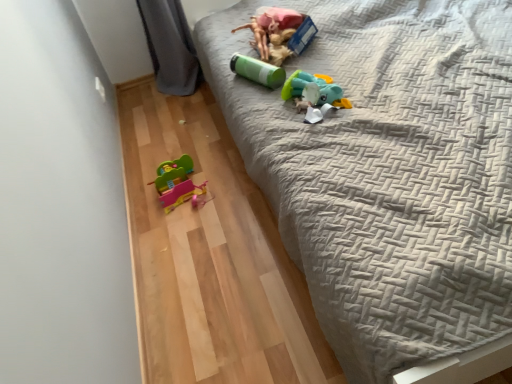
Locate an element on the screen. Image resolution: width=512 pixels, height=384 pixels. green matte canister at upper center, the second toy in the top-to-bottom sequence is located at coordinates (257, 71).

Where is `gray quilted bed at upper right`? This screenshot has width=512, height=384. gray quilted bed at upper right is located at coordinates (388, 172).

Identify the location of teal matte plush toy at upper center, which is counted as the second toy, starting from the bottom. (314, 94).

You are a GUI agent. You are given a task and a screenshot of the screen. Output one action in this format:
    pyautogui.click(x=<x>, y=<y>)
    Task: Click on the matte green plastic cup at upper center, which is the first toy in top-to-bottom order
    
    Given the screenshot: What is the action you would take?
    pyautogui.click(x=273, y=32)

The width and height of the screenshot is (512, 384). Describe the element at coordinates (176, 183) in the screenshot. I see `matte plastic toy car at lower left, which is counted as the 4th toy, starting from the top` at that location.

Identify the location of green matte canister at upper center, the second toy in the top-to-bottom sequence. Image resolution: width=512 pixels, height=384 pixels. (257, 71).

Is matte green plastic cup at upper center, which is the first toy in top-to-bottom order, positioned with its back to teal matte plush toy at upper center, which is counted as the second toy, starting from the bottom?

No, matte green plastic cup at upper center, which is the first toy in top-to-bottom order,'s orientation is not away from teal matte plush toy at upper center, which is counted as the second toy, starting from the bottom.

From the image's perspective, is matte green plastic cup at upper center, the 4th toy from the bottom, on teal matte plush toy at upper center, acting as the third toy starting from the top?

Yes, from the image's perspective, matte green plastic cup at upper center, the 4th toy from the bottom, is over teal matte plush toy at upper center, acting as the third toy starting from the top.

Is matte green plastic cup at upper center, the 4th toy from the bottom, directly adjacent to teal matte plush toy at upper center, acting as the third toy starting from the top?

No, matte green plastic cup at upper center, the 4th toy from the bottom, is not touching teal matte plush toy at upper center, acting as the third toy starting from the top.

Is point (280, 48) behind point (310, 105)?

Yes, point (280, 48) is farther from viewer.

Considering the positions of objects teal matte plush toy at upper center, acting as the third toy starting from the top, and gray quilted bed at upper right in the image provided, who is more to the left, teal matte plush toy at upper center, acting as the third toy starting from the top, or gray quilted bed at upper right?

teal matte plush toy at upper center, acting as the third toy starting from the top.

Which is behind, point (341, 104) or point (450, 72)?

Positioned behind is point (450, 72).

From the image's perspective, which object appears higher, teal matte plush toy at upper center, acting as the third toy starting from the top, or gray quilted bed at upper right?

gray quilted bed at upper right, from the image's perspective.

Does teal matte plush toy at upper center, acting as the third toy starting from the top, lie in front of gray quilted bed at upper right?

No.

From the image's perspective, is gray quilted bed at upper right positioned above or below green matte canister at upper center, which is the third toy from bottom to top?

Based on their image positions, gray quilted bed at upper right is located above green matte canister at upper center, which is the third toy from bottom to top.

Is point (368, 334) farther from camera compared to point (249, 72)?

That is False.

In the scene shown: What's the angular difference between gray quilted bed at upper right and green matte canister at upper center, which is the third toy from bottom to top,'s facing directions?

The angular difference between gray quilted bed at upper right and green matte canister at upper center, which is the third toy from bottom to top, is 26.3 degrees.

Who is taller, gray quilted bed at upper right or green matte canister at upper center, which is the third toy from bottom to top?

Standing taller between the two is gray quilted bed at upper right.

From a real-world perspective, which is physically below, green matte canister at upper center, which is the third toy from bottom to top, or matte green plastic cup at upper center, the 4th toy from the bottom?

From a 3D spatial view, green matte canister at upper center, which is the third toy from bottom to top, is below.

Is green matte canister at upper center, which is the third toy from bottom to top, with matte green plastic cup at upper center, which is the first toy in top-to-bottom order?

No, green matte canister at upper center, which is the third toy from bottom to top, is not in contact with matte green plastic cup at upper center, which is the first toy in top-to-bottom order.

Does green matte canister at upper center, the second toy in the top-to-bottom sequence, appear on the right side of matte green plastic cup at upper center, the 4th toy from the bottom?

No.

The image size is (512, 384). In order to click on toy above the green matte canister at upper center, the second toy in the top-to-bottom sequence (from the image's perspective) in this screenshot , I will do `click(273, 32)`.

In terms of size, does matte plastic toy car at lower left, marked as the 1th toy in a bottom-to-top arrangement, appear bigger or smaller than gray quilted bed at upper right?

Clearly, matte plastic toy car at lower left, marked as the 1th toy in a bottom-to-top arrangement, is smaller in size than gray quilted bed at upper right.

What's the angular difference between matte plastic toy car at lower left, which is counted as the 4th toy, starting from the top, and gray quilted bed at upper right's facing directions?

The angle between the facing direction of matte plastic toy car at lower left, which is counted as the 4th toy, starting from the top, and the facing direction of gray quilted bed at upper right is 89.8 degrees.

From a real-world perspective, is matte plastic toy car at lower left, which is counted as the 4th toy, starting from the top, over gray quilted bed at upper right?

Actually, matte plastic toy car at lower left, which is counted as the 4th toy, starting from the top, is physically below gray quilted bed at upper right in the real world.

Can you see green matte canister at upper center, the second toy in the top-to-bottom sequence, touching teal matte plush toy at upper center, which is counted as the second toy, starting from the bottom?

There is a gap between green matte canister at upper center, the second toy in the top-to-bottom sequence, and teal matte plush toy at upper center, which is counted as the second toy, starting from the bottom.

Is point (248, 78) in front of point (304, 94)?

No, it is behind (304, 94).

Could you tell me if green matte canister at upper center, which is the third toy from bottom to top, is turned towards teal matte plush toy at upper center, which is counted as the second toy, starting from the bottom?

Yes, green matte canister at upper center, which is the third toy from bottom to top, is facing teal matte plush toy at upper center, which is counted as the second toy, starting from the bottom.

Between green matte canister at upper center, the second toy in the top-to-bottom sequence, and teal matte plush toy at upper center, which is counted as the second toy, starting from the bottom, which one has larger size?

With larger size is teal matte plush toy at upper center, which is counted as the second toy, starting from the bottom.

Which object is closer to the camera, gray quilted bed at upper right or matte plastic toy car at lower left, which is counted as the 4th toy, starting from the top?

Positioned in front is gray quilted bed at upper right.

Which is more to the left, gray quilted bed at upper right or matte plastic toy car at lower left, which is counted as the 4th toy, starting from the top?

matte plastic toy car at lower left, which is counted as the 4th toy, starting from the top, is more to the left.

From a real-world perspective, is gray quilted bed at upper right beneath matte plastic toy car at lower left, which is counted as the 4th toy, starting from the top?

Incorrect, from a real-world perspective, gray quilted bed at upper right is higher than matte plastic toy car at lower left, which is counted as the 4th toy, starting from the top.

Is matte plastic toy car at lower left, marked as the 1th toy in a bottom-to-top arrangement, at the back of gray quilted bed at upper right?

No, gray quilted bed at upper right's orientation is not away from matte plastic toy car at lower left, marked as the 1th toy in a bottom-to-top arrangement.

Where is `toy that is the 2nd one when counting upward from the teal matte plush toy at upper center, acting as the third toy starting from the top (from the image's perspective)`? The image size is (512, 384). toy that is the 2nd one when counting upward from the teal matte plush toy at upper center, acting as the third toy starting from the top (from the image's perspective) is located at coordinates (273, 32).

You are a GUI agent. You are given a task and a screenshot of the screen. Output one action in this format:
    pyautogui.click(x=<x>, y=<y>)
    Task: Click on the bed on the right of teal matte plush toy at upper center, which is counted as the second toy, starting from the bottom
    This screenshot has width=512, height=384.
    Given the screenshot: What is the action you would take?
    pyautogui.click(x=388, y=172)

Estimate the real-world distances between objects in this image. Which object is further from teal matte plush toy at upper center, acting as the third toy starting from the top, gray quilted bed at upper right or green matte canister at upper center, which is the third toy from bottom to top?

gray quilted bed at upper right lies further to teal matte plush toy at upper center, acting as the third toy starting from the top, than the other object.

Estimate the real-world distances between objects in this image. Which object is further from gray quilted bed at upper right, teal matte plush toy at upper center, which is counted as the second toy, starting from the bottom, or matte green plastic cup at upper center, which is the first toy in top-to-bottom order?

matte green plastic cup at upper center, which is the first toy in top-to-bottom order.

Which object lies further to the anchor point teal matte plush toy at upper center, which is counted as the second toy, starting from the bottom, matte plastic toy car at lower left, which is counted as the 4th toy, starting from the top, or green matte canister at upper center, which is the third toy from bottom to top?

Among the two, matte plastic toy car at lower left, which is counted as the 4th toy, starting from the top, is located further to teal matte plush toy at upper center, which is counted as the second toy, starting from the bottom.

Based on their spatial positions, is teal matte plush toy at upper center, acting as the third toy starting from the top, or green matte canister at upper center, which is the third toy from bottom to top, closer to gray quilted bed at upper right?

teal matte plush toy at upper center, acting as the third toy starting from the top, is closer to gray quilted bed at upper right.

Which object lies nearer to the anchor point green matte canister at upper center, which is the third toy from bottom to top, matte plastic toy car at lower left, marked as the 1th toy in a bottom-to-top arrangement, or matte green plastic cup at upper center, the 4th toy from the bottom?

matte green plastic cup at upper center, the 4th toy from the bottom, is positioned closer to the anchor green matte canister at upper center, which is the third toy from bottom to top.

Considering their positions, is green matte canister at upper center, which is the third toy from bottom to top, positioned closer to gray quilted bed at upper right than matte plastic toy car at lower left, marked as the 1th toy in a bottom-to-top arrangement?

Among the two, green matte canister at upper center, which is the third toy from bottom to top, is located nearer to gray quilted bed at upper right.

From the image, which object appears to be nearer to green matte canister at upper center, the second toy in the top-to-bottom sequence, teal matte plush toy at upper center, acting as the third toy starting from the top, or gray quilted bed at upper right?

teal matte plush toy at upper center, acting as the third toy starting from the top.

When comparing their distances from matte green plastic cup at upper center, the 4th toy from the bottom, does green matte canister at upper center, the second toy in the top-to-bottom sequence, or gray quilted bed at upper right seem closer?

Among the two, green matte canister at upper center, the second toy in the top-to-bottom sequence, is located nearer to matte green plastic cup at upper center, the 4th toy from the bottom.

The height and width of the screenshot is (384, 512). Identify the location of toy between matte green plastic cup at upper center, which is the first toy in top-to-bottom order, and teal matte plush toy at upper center, which is counted as the second toy, starting from the bottom, vertically. coord(257,71).

Image resolution: width=512 pixels, height=384 pixels. Identify the location of toy located between gray quilted bed at upper right and green matte canister at upper center, the second toy in the top-to-bottom sequence, in the depth direction. 314,94.